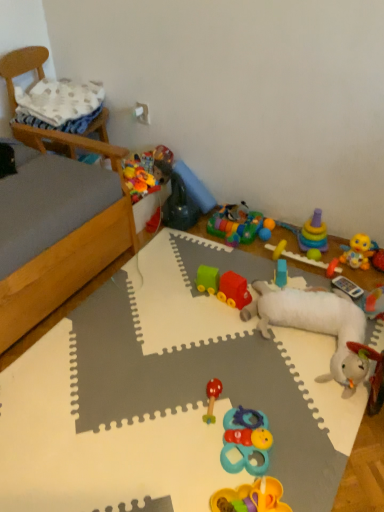
Locate an element on the screen. This screenshot has width=384, height=512. vacant region to the left of blue plastic toy at center, which is counted as the sixth toy, starting from the top is located at coordinates (249, 275).